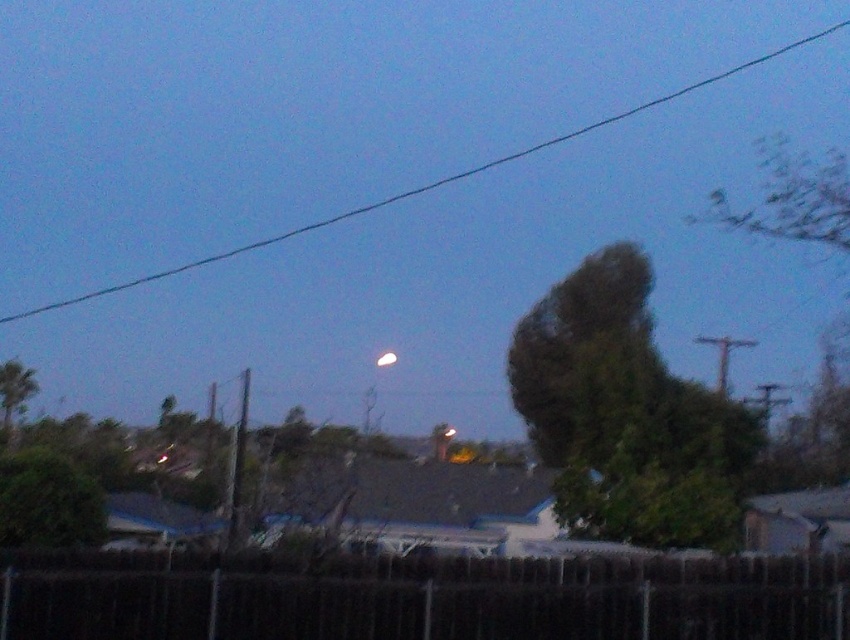
Question: Which of these objects is positioned farthest from the green leafy tree at upper right?

Choices:
 (A) green leafy tree at lower left
 (B) black wire at upper center

Answer: (B)

Question: Which point is closer to the camera taking this photo?

Choices:
 (A) (82, 540)
 (B) (394, 358)

Answer: (A)

Question: Which object is positioned closest to the black metal fence at lower center?

Choices:
 (A) green leafy tree at lower left
 (B) white glossy moon at upper center

Answer: (A)

Question: Is black metal fence at lower center further to the viewer compared to white glossy moon at upper center?

Choices:
 (A) no
 (B) yes

Answer: (A)

Question: Observing the image, what is the correct spatial positioning of green leafy tree at lower left in reference to green leafy tree at left?

Choices:
 (A) right
 (B) left

Answer: (A)

Question: Considering the relative positions of black metal fence at lower center and green leafy tree at left in the image provided, where is black metal fence at lower center located with respect to green leafy tree at left?

Choices:
 (A) below
 (B) above

Answer: (A)